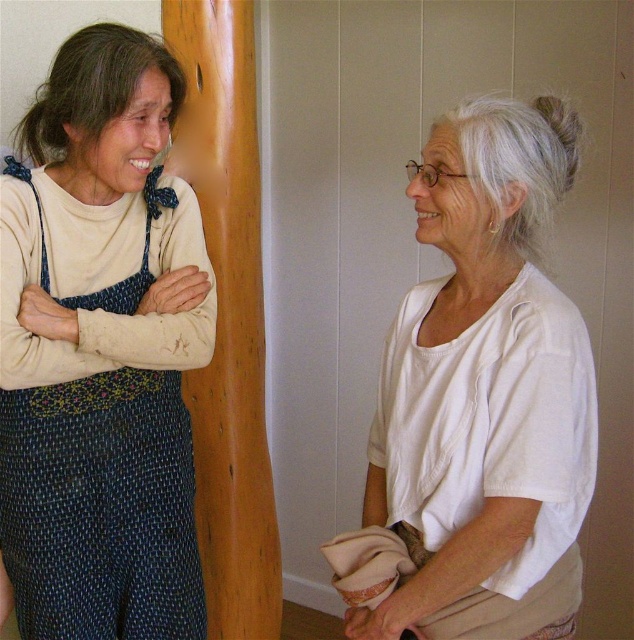
Who is positioned more to the right, blue woven apron at left or white cotton sleeve at upper left?

white cotton sleeve at upper left is more to the right.

Can you confirm if blue woven apron at left is wider than white cotton sleeve at upper left?

Yes, blue woven apron at left is wider than white cotton sleeve at upper left.

Where is `blue woven apron at left`? The image size is (634, 640). blue woven apron at left is located at coordinates (100, 508).

Looking at this image, is white cotton shirt at right further to camera compared to blue woven apron at left?

That is False.

Who is lower down, white cotton shirt at right or blue woven apron at left?

Positioned lower is blue woven apron at left.

Who is more forward, [455,588] or [30,461]?

Point [455,588] is in front.

I want to click on white cotton shirt at right, so click(x=482, y=372).

What do you see at coordinates (482, 372) in the screenshot? Image resolution: width=634 pixels, height=640 pixels. I see `white cotton shirt at right` at bounding box center [482, 372].

Identify the location of white cotton shirt at right. (482, 372).

Is point (451, 164) more distant than point (169, 353)?

No, (451, 164) is in front of (169, 353).

At what (x,y) coordinates should I click in order to perform the action: click on white cotton shirt at right. Please return your answer as a coordinate pair (x, y). The width and height of the screenshot is (634, 640). Looking at the image, I should click on (482, 372).